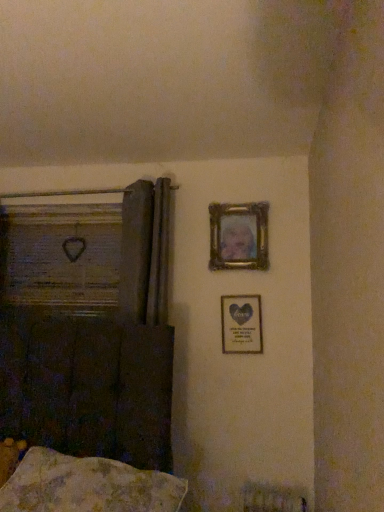
Question: Considering the relative sizes of wooden frame at left and fluffy beige pillow at lower left in the image provided, is wooden frame at left taller than fluffy beige pillow at lower left?

Choices:
 (A) yes
 (B) no

Answer: (A)

Question: Can you confirm if wooden frame at left is bigger than fluffy beige pillow at lower left?

Choices:
 (A) yes
 (B) no

Answer: (B)

Question: Is wooden frame at left closer to camera compared to fluffy beige pillow at lower left?

Choices:
 (A) no
 (B) yes

Answer: (A)

Question: Is wooden frame at left surrounding fluffy beige pillow at lower left?

Choices:
 (A) no
 (B) yes

Answer: (A)

Question: Can you see wooden frame at left touching fluffy beige pillow at lower left?

Choices:
 (A) no
 (B) yes

Answer: (A)

Question: Looking at the image, does fluffy beige pillow at lower left seem bigger or smaller compared to metallic gold picture frame at center-right, which is the 1th picture frame in bottom-to-top order?

Choices:
 (A) small
 (B) big

Answer: (B)

Question: Considering the positions of fluffy beige pillow at lower left and metallic gold picture frame at center-right, the second picture frame positioned from the top, in the image, is fluffy beige pillow at lower left wider or thinner than metallic gold picture frame at center-right, the second picture frame positioned from the top,?

Choices:
 (A) thin
 (B) wide

Answer: (B)

Question: Considering the relative positions of fluffy beige pillow at lower left and metallic gold picture frame at center-right, which is the 1th picture frame in bottom-to-top order, in the image provided, is fluffy beige pillow at lower left to the left or to the right of metallic gold picture frame at center-right, which is the 1th picture frame in bottom-to-top order,?

Choices:
 (A) left
 (B) right

Answer: (A)

Question: From the image's perspective, is fluffy beige pillow at lower left positioned above or below metallic gold picture frame at center-right, the second picture frame positioned from the top?

Choices:
 (A) above
 (B) below

Answer: (B)

Question: In the image, is gold metallic picture frame at upper center, the 1th picture frame in the top-to-bottom sequence, positioned in front of or behind metallic gold picture frame at center-right, which is the 1th picture frame in bottom-to-top order?

Choices:
 (A) behind
 (B) front

Answer: (A)

Question: From a real-world perspective, is gold metallic picture frame at upper center, positioned as the second picture frame in bottom-to-top order, positioned above or below metallic gold picture frame at center-right, the second picture frame positioned from the top?

Choices:
 (A) above
 (B) below

Answer: (A)

Question: Is point (226, 248) closer or farther from the camera than point (223, 296)?

Choices:
 (A) farther
 (B) closer

Answer: (A)

Question: Is gold metallic picture frame at upper center, the 1th picture frame in the top-to-bottom sequence, taller or shorter than metallic gold picture frame at center-right, which is the 1th picture frame in bottom-to-top order?

Choices:
 (A) tall
 (B) short

Answer: (A)

Question: Is wooden frame at left in front of or behind fluffy beige pillow at lower left in the image?

Choices:
 (A) behind
 (B) front

Answer: (A)

Question: In terms of size, does wooden frame at left appear bigger or smaller than fluffy beige pillow at lower left?

Choices:
 (A) big
 (B) small

Answer: (B)